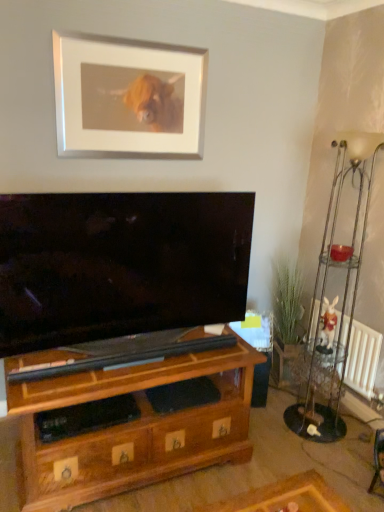
Question: Is brown wood shelf at lower left inside metallic silver floor lamp at right?

Choices:
 (A) yes
 (B) no

Answer: (B)

Question: Does metallic silver floor lamp at right turn towards brown wood shelf at lower left?

Choices:
 (A) yes
 (B) no

Answer: (B)

Question: From a real-world perspective, is metallic silver floor lamp at right physically below brown wood shelf at lower left?

Choices:
 (A) no
 (B) yes

Answer: (A)

Question: Is metallic silver floor lamp at right looking in the opposite direction of brown wood shelf at lower left?

Choices:
 (A) yes
 (B) no

Answer: (B)

Question: Is metallic silver floor lamp at right further to the viewer compared to brown wood shelf at lower left?

Choices:
 (A) yes
 (B) no

Answer: (A)

Question: Is point (29, 391) positioned closer to the camera than point (342, 426)?

Choices:
 (A) farther
 (B) closer

Answer: (B)

Question: Is brown wood shelf at lower left inside the boundaries of metallic silver side table at right, or outside?

Choices:
 (A) outside
 (B) inside

Answer: (A)

Question: Is brown wood shelf at lower left wider or thinner than metallic silver side table at right?

Choices:
 (A) wide
 (B) thin

Answer: (A)

Question: Considering their positions, is brown wood shelf at lower left located in front of or behind metallic silver side table at right?

Choices:
 (A) front
 (B) behind

Answer: (A)

Question: From a real-world perspective, is metallic silver side table at right positioned above or below brown wood shelf at lower left?

Choices:
 (A) above
 (B) below

Answer: (A)

Question: In the image, is metallic silver side table at right positioned in front of or behind brown wood shelf at lower left?

Choices:
 (A) behind
 (B) front

Answer: (A)

Question: Choose the correct answer: Is metallic silver side table at right inside brown wood shelf at lower left or outside it?

Choices:
 (A) inside
 (B) outside

Answer: (B)

Question: Considering the positions of point (314, 409) and point (117, 489), is point (314, 409) closer or farther from the camera than point (117, 489)?

Choices:
 (A) farther
 (B) closer

Answer: (A)

Question: From the image's perspective, is metallic silver floor lamp at right located above or below white matte picture frame at upper center?

Choices:
 (A) above
 (B) below

Answer: (B)

Question: In the image, is metallic silver floor lamp at right positioned in front of or behind white matte picture frame at upper center?

Choices:
 (A) behind
 (B) front

Answer: (B)